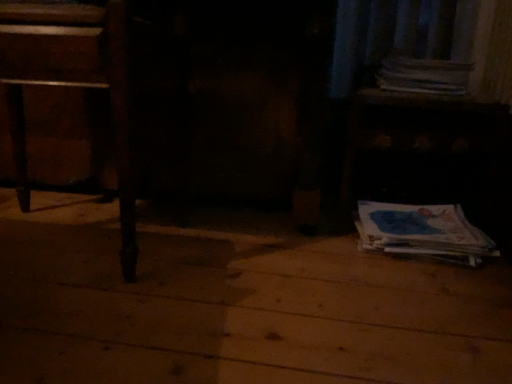
Find the location of `free space in front of blue paper at lower right, the first paperback book ordered from the bottom`. free space in front of blue paper at lower right, the first paperback book ordered from the bottom is located at coordinates (429, 293).